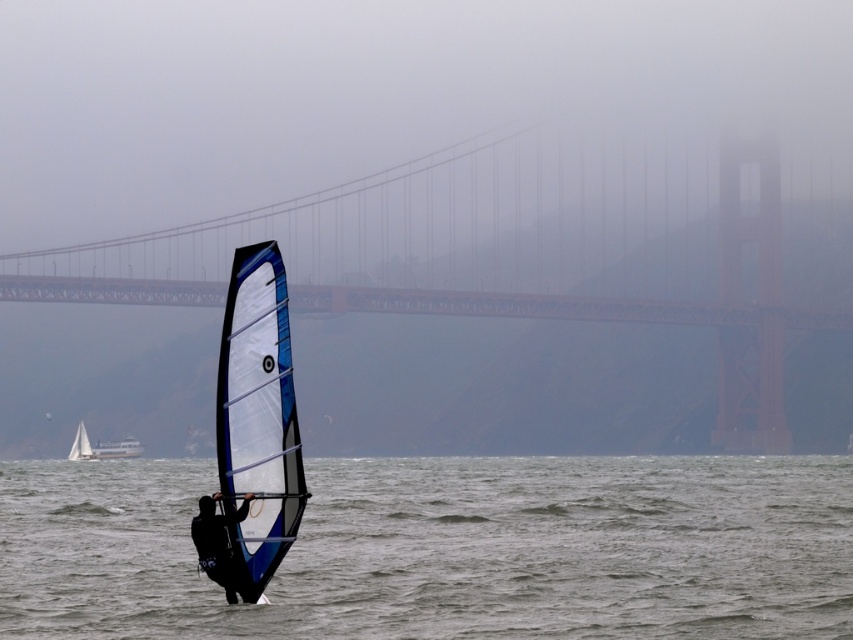
You are a photographer trying to capture the Golden Gate Bridge in the background. You notice a translucent blue water at center and a white plastic boat at lower left. Which object should you position closer to the left side of your frame to ensure the Golden Gate Bridge remains visible in the shot?

You should position the white plastic boat at lower left closer to the left side of your frame since the translucent blue water at center is to the right of it, allowing the Golden Gate Bridge in the background to stay visible.

Based on the photo, you are a photographer trying to capture the windsurfer and the Golden Gate Bridge in the background. You notice a translucent blue water at center and a white plastic boat at lower left in your shot. Which object should you focus on first if you want to ensure both the windsurfer and the bridge are in sharp focus?

You should focus on the translucent blue water at center first because it is located above the white plastic boat at lower left, meaning it is closer to the camera. Focusing on the closer object will help ensure the windsurfer and bridge remain in focus as they are part of the same depth plane.